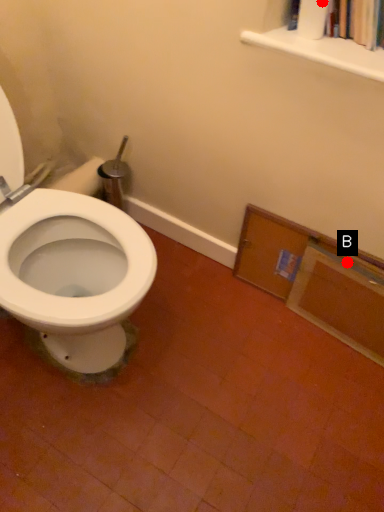
Question: Two points are circled on the image, labeled by A and B beside each circle. Which point is farther from the camera taking this photo?

Choices:
 (A) A is further
 (B) B is further

Answer: (B)